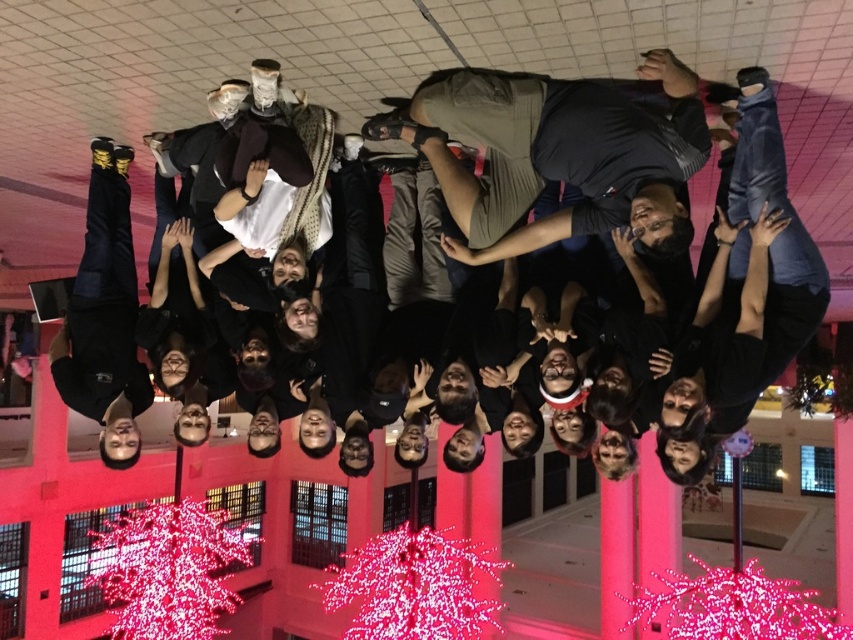
Is black matte shirt at center below khaki cotton shorts at center?

Yes.

Can you confirm if black matte shirt at center is taller than khaki cotton shorts at center?

Correct, black matte shirt at center is much taller as khaki cotton shorts at center.

Is point (695, 156) behind point (666, 124)?

No.

The height and width of the screenshot is (640, 853). Identify the location of black matte shirt at center. (556, 154).